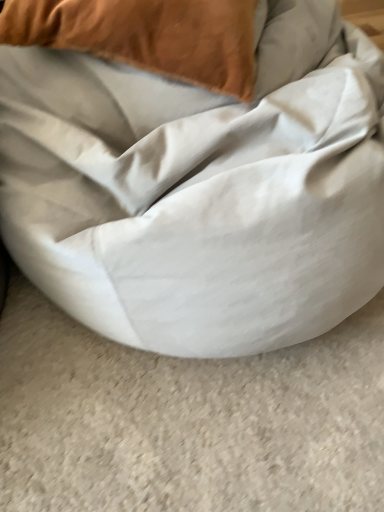
Question: Should I look upward or downward to see white fabric bean bag at center?

Choices:
 (A) up
 (B) down

Answer: (A)

Question: Is velvet orange pillow at upper left to the left of white fabric bean bag at center from the viewer's perspective?

Choices:
 (A) no
 (B) yes

Answer: (B)

Question: From a real-world perspective, is velvet orange pillow at upper left physically above white fabric bean bag at center?

Choices:
 (A) yes
 (B) no

Answer: (A)

Question: Can you see velvet orange pillow at upper left touching white fabric bean bag at center?

Choices:
 (A) no
 (B) yes

Answer: (A)

Question: Is velvet orange pillow at upper left further to camera compared to white fabric bean bag at center?

Choices:
 (A) yes
 (B) no

Answer: (A)

Question: From a real-world perspective, is velvet orange pillow at upper left under white fabric bean bag at center?

Choices:
 (A) yes
 (B) no

Answer: (B)

Question: Would you consider velvet orange pillow at upper left to be distant from white fabric bean bag at center?

Choices:
 (A) no
 (B) yes

Answer: (A)

Question: Is white fabric bean bag at center not inside velvet orange pillow at upper left?

Choices:
 (A) no
 (B) yes

Answer: (B)

Question: Can you confirm if white fabric bean bag at center is thinner than velvet orange pillow at upper left?

Choices:
 (A) yes
 (B) no

Answer: (B)

Question: Does white fabric bean bag at center contain velvet orange pillow at upper left?

Choices:
 (A) no
 (B) yes

Answer: (B)

Question: Does white fabric bean bag at center turn towards velvet orange pillow at upper left?

Choices:
 (A) yes
 (B) no

Answer: (B)

Question: Can you confirm if white fabric bean bag at center is positioned to the right of velvet orange pillow at upper left?

Choices:
 (A) no
 (B) yes

Answer: (B)

Question: Are white fabric bean bag at center and velvet orange pillow at upper left located far from each other?

Choices:
 (A) no
 (B) yes

Answer: (A)

Question: Is velvet orange pillow at upper left bigger or smaller than white fabric bean bag at center?

Choices:
 (A) big
 (B) small

Answer: (B)